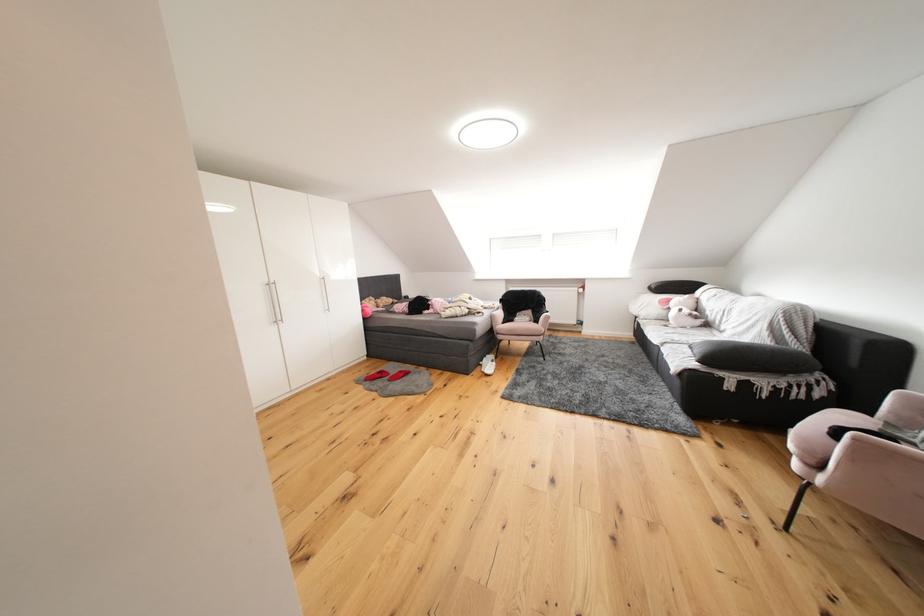
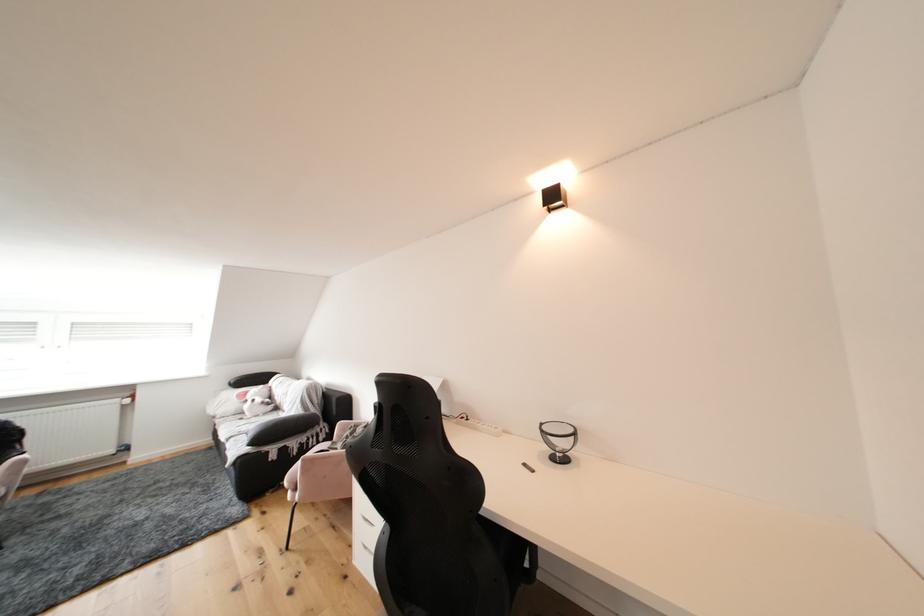
Find the pixel in the second image that matches pixel 797 395 in the first image.

(317, 447)